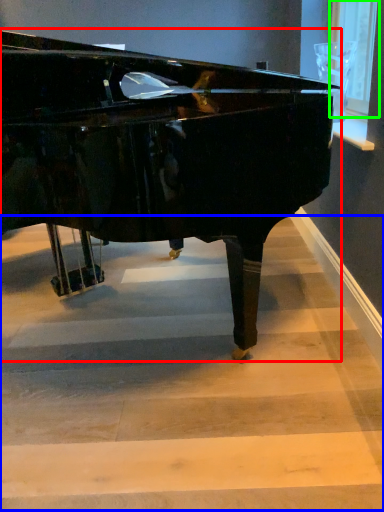
Question: Which is nearer to the piano (highlighted by a red box)? stairwell (highlighted by a blue box) or window screen (highlighted by a green box).

Choices:
 (A) stairwell
 (B) window screen

Answer: (A)